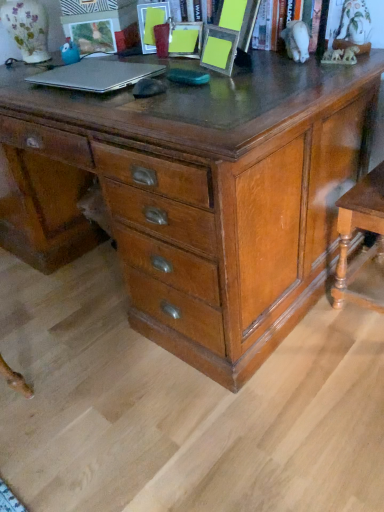
Where is `free location in front of silver metallic laptop at upper left`? free location in front of silver metallic laptop at upper left is located at coordinates (105, 100).